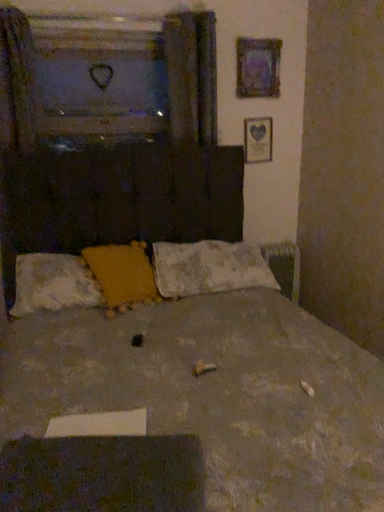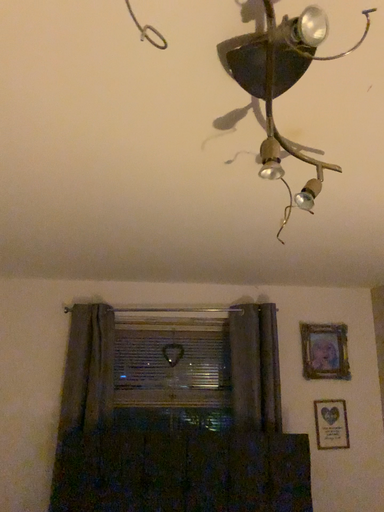
Question: How did the camera likely rotate when shooting the video?

Choices:
 (A) rotated right
 (B) rotated left

Answer: (B)